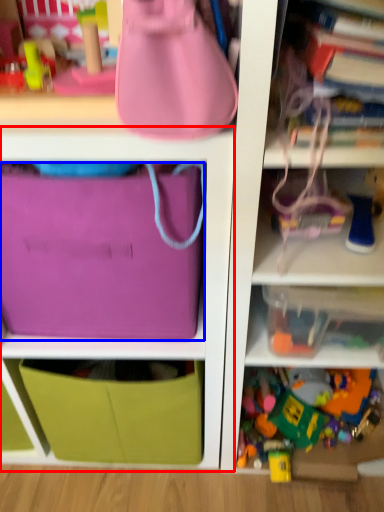
Question: Which object appears farthest to the camera in this image, cabinet (highlighted by a red box) or pouch (highlighted by a blue box)?

Choices:
 (A) cabinet
 (B) pouch

Answer: (B)